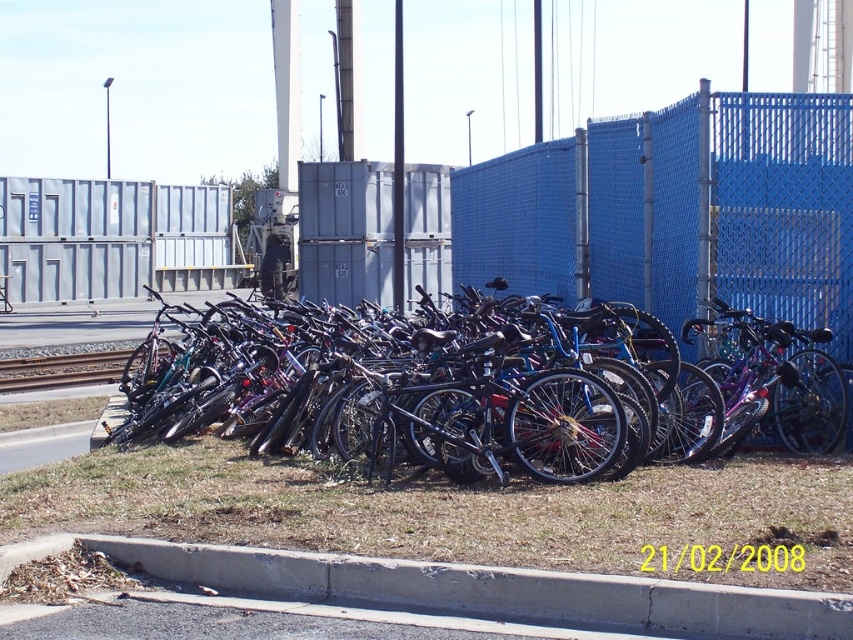
Question: Based on their relative distances, which object is farther from the brushed metal train track at left?

Choices:
 (A) shiny metallic bicycles at center
 (B) blue mesh fence at center
 (C) concrete at lower center

Answer: (C)

Question: Is blue mesh fence at center positioned behind shiny metallic bicycles at center?

Choices:
 (A) yes
 (B) no

Answer: (A)

Question: Considering the real-world distances, which object is farthest from the blue mesh fence at center?

Choices:
 (A) brushed metal train track at left
 (B) shiny metallic bicycles at center

Answer: (A)

Question: Is blue mesh fence at center positioned in front of brushed metal train track at left?

Choices:
 (A) no
 (B) yes

Answer: (B)

Question: Which object is positioned farthest from the shiny metallic bicycles at center?

Choices:
 (A) concrete at lower center
 (B) blue mesh fence at center

Answer: (B)

Question: Observing the image, what is the correct spatial positioning of blue mesh fence at center in reference to brushed metal train track at left?

Choices:
 (A) right
 (B) left

Answer: (A)